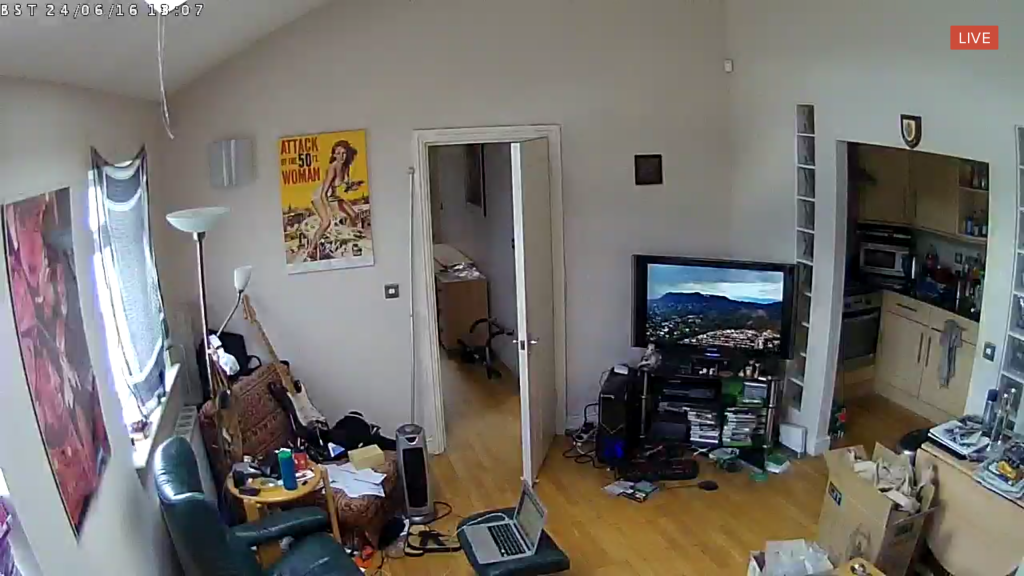
I want to click on teal comfortable chair, so coord(307,557).